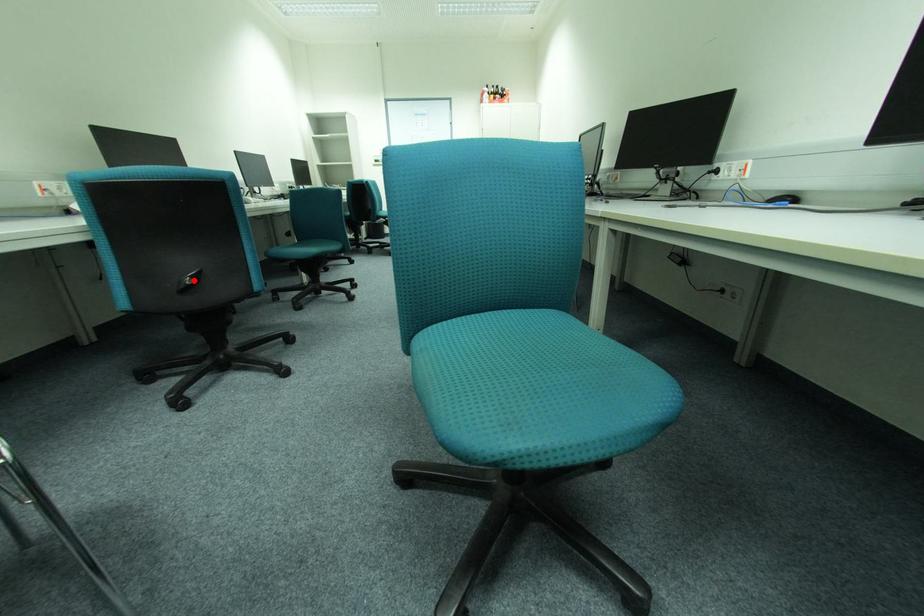
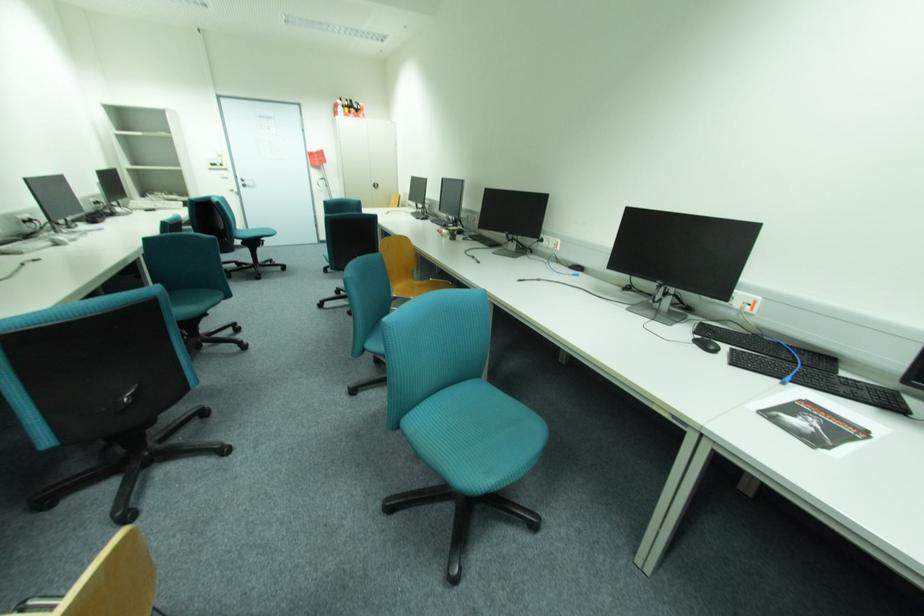
Locate, in the second image, the point that corresponds to the highlighted location in the first image.

(134, 399)